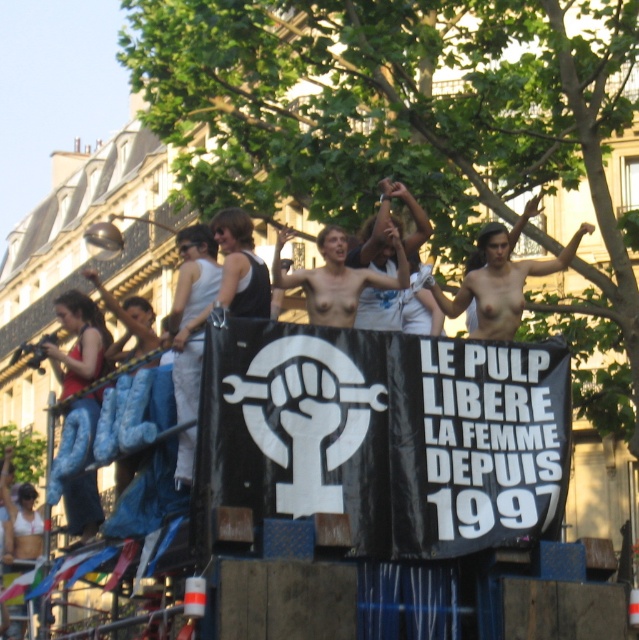
Question: Can you confirm if black fabric banner at center is thinner than nude torso at center?

Choices:
 (A) no
 (B) yes

Answer: (A)

Question: Can you confirm if skinny white torso at center is wider than nude torso at center?

Choices:
 (A) no
 (B) yes

Answer: (B)

Question: Which is nearer to the nude torso at center?

Choices:
 (A) skinny white torso at center
 (B) black fabric banner at center

Answer: (A)

Question: Which object appears closest to the camera in this image?

Choices:
 (A) nude torso at center
 (B) skinny white torso at center

Answer: (A)

Question: Where is black fabric banner at center located in relation to skinny white torso at center in the image?

Choices:
 (A) right
 (B) left

Answer: (B)

Question: Which object appears closest to the camera in this image?

Choices:
 (A) black fabric banner at center
 (B) skinny white torso at center

Answer: (A)